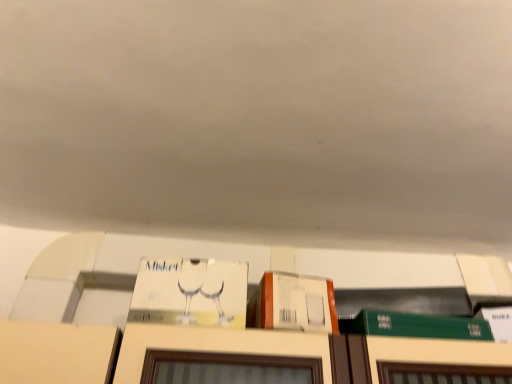
Question: Is green matte book at lower right, the second book from the left, thinner than white cardboard box at center, arranged as the 1th book when viewed from the left?

Choices:
 (A) yes
 (B) no

Answer: (B)

Question: Is green matte book at lower right, the second book from the left, positioned behind white cardboard box at center, the second book viewed from the right?

Choices:
 (A) yes
 (B) no

Answer: (A)

Question: Is green matte book at lower right, which is counted as the first book, starting from the right, facing away from white cardboard box at center, the second book viewed from the right?

Choices:
 (A) yes
 (B) no

Answer: (B)

Question: Is green matte book at lower right, the second book from the left, taller than white cardboard box at center, arranged as the 1th book when viewed from the left?

Choices:
 (A) no
 (B) yes

Answer: (A)

Question: Can you confirm if green matte book at lower right, the second book from the left, is bigger than white cardboard box at center, the second book viewed from the right?

Choices:
 (A) no
 (B) yes

Answer: (A)

Question: From a real-world perspective, is green matte book at lower right, the second book from the left, located beneath white cardboard box at center, arranged as the 1th book when viewed from the left?

Choices:
 (A) no
 (B) yes

Answer: (B)

Question: Does orange matte cardboard box at upper center have a greater width compared to white cardboard box at center, arranged as the 1th book when viewed from the left?

Choices:
 (A) yes
 (B) no

Answer: (A)

Question: Does orange matte cardboard box at upper center turn towards white cardboard box at center, arranged as the 1th book when viewed from the left?

Choices:
 (A) no
 (B) yes

Answer: (A)

Question: Does orange matte cardboard box at upper center have a greater height compared to white cardboard box at center, arranged as the 1th book when viewed from the left?

Choices:
 (A) no
 (B) yes

Answer: (A)

Question: Does orange matte cardboard box at upper center have a lesser height compared to white cardboard box at center, the second book viewed from the right?

Choices:
 (A) no
 (B) yes

Answer: (B)

Question: Is orange matte cardboard box at upper center positioned with its back to white cardboard box at center, the second book viewed from the right?

Choices:
 (A) no
 (B) yes

Answer: (A)

Question: From a real-world perspective, is orange matte cardboard box at upper center on top of white cardboard box at center, arranged as the 1th book when viewed from the left?

Choices:
 (A) yes
 (B) no

Answer: (B)

Question: Can you confirm if white cardboard box at center, the second book viewed from the right, is bigger than green matte book at lower right, which is counted as the first book, starting from the right?

Choices:
 (A) yes
 (B) no

Answer: (A)